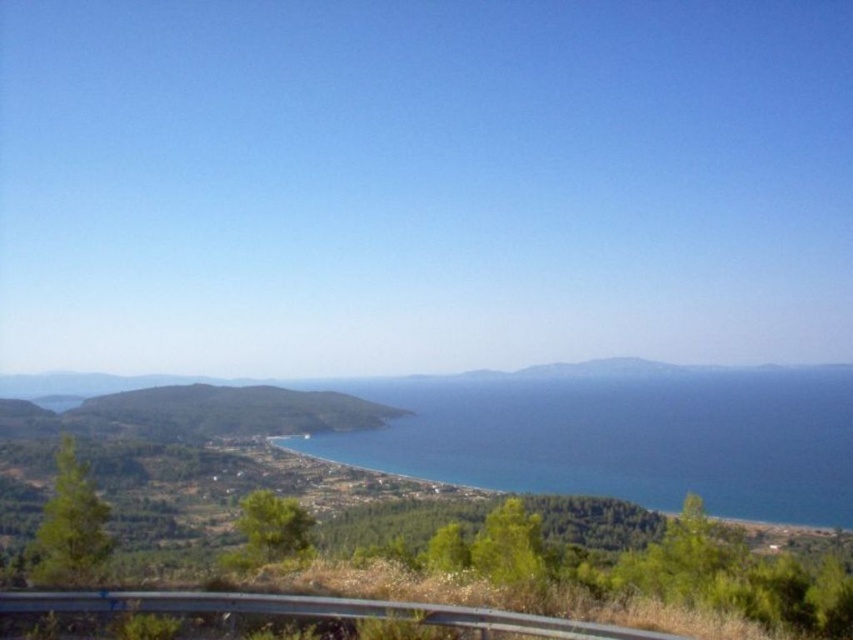
Question: Does blue water at center appear on the left side of metallic gray guardrail at lower center?

Choices:
 (A) no
 (B) yes

Answer: (A)

Question: Can you confirm if blue water at center is positioned to the left of metallic gray guardrail at lower center?

Choices:
 (A) yes
 (B) no

Answer: (B)

Question: Which of the following is the farthest from the observer?

Choices:
 (A) metallic gray guardrail at lower center
 (B) blue water at center

Answer: (B)

Question: Is blue water at center positioned before metallic gray guardrail at lower center?

Choices:
 (A) no
 (B) yes

Answer: (A)